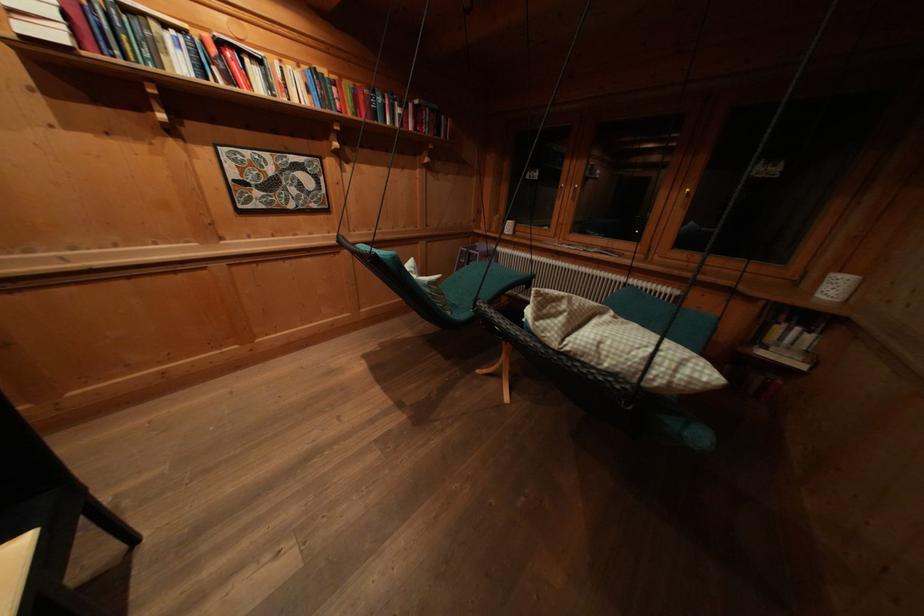
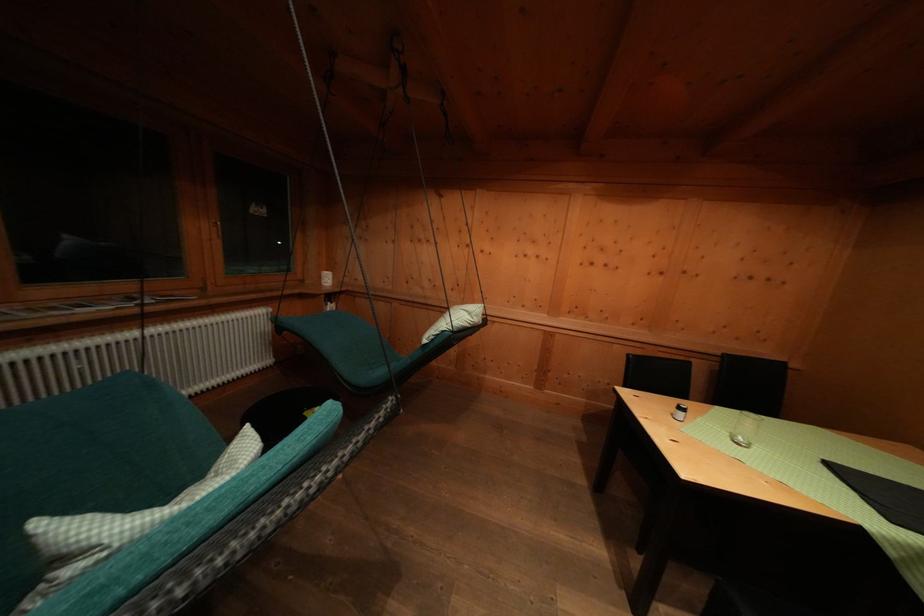
Find the pixel in the second image that matches [796,334] in the first image.

(333, 310)